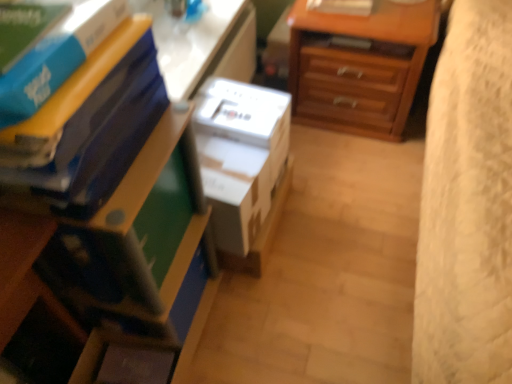
I want to click on empty space that is ontop of white cardboard box at center (from a real-world perspective), so click(x=239, y=101).